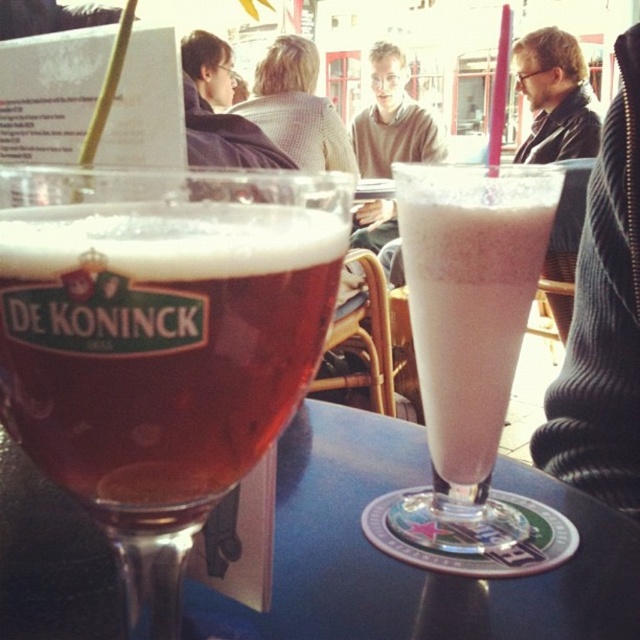
Question: Which object is farther from the camera taking this photo?

Choices:
 (A) milky white frosted glass at center
 (B) light beige sweater at center

Answer: (B)

Question: Which point is closer to the camera?

Choices:
 (A) (548, 468)
 (B) (308, 90)
 (C) (358, 170)

Answer: (A)

Question: Is milky white frosted glass at center smaller than smooth leather jacket at upper right?

Choices:
 (A) yes
 (B) no

Answer: (A)

Question: Considering the relative positions of black ribbed sweater at upper right and light beige sweater at center in the image provided, where is black ribbed sweater at upper right located with respect to light beige sweater at center?

Choices:
 (A) right
 (B) left

Answer: (A)

Question: Does translucent glass beer at center have a greater width compared to matte brown sweater at center?

Choices:
 (A) yes
 (B) no

Answer: (B)

Question: Based on their relative distances, which object is nearer to the milky white frosted glass at center?

Choices:
 (A) black ribbed sweater at upper right
 (B) light beige sweater at center
 (C) smooth leather jacket at upper right
 (D) translucent glass beer at center

Answer: (D)